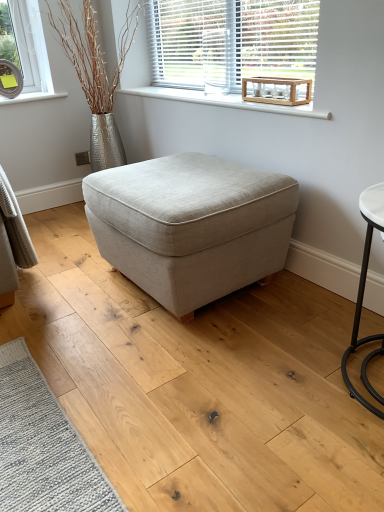
Locate an element on the screen. The image size is (384, 512). free space above beige fabric ottoman at center (from a real-world perspective) is located at coordinates (186, 176).